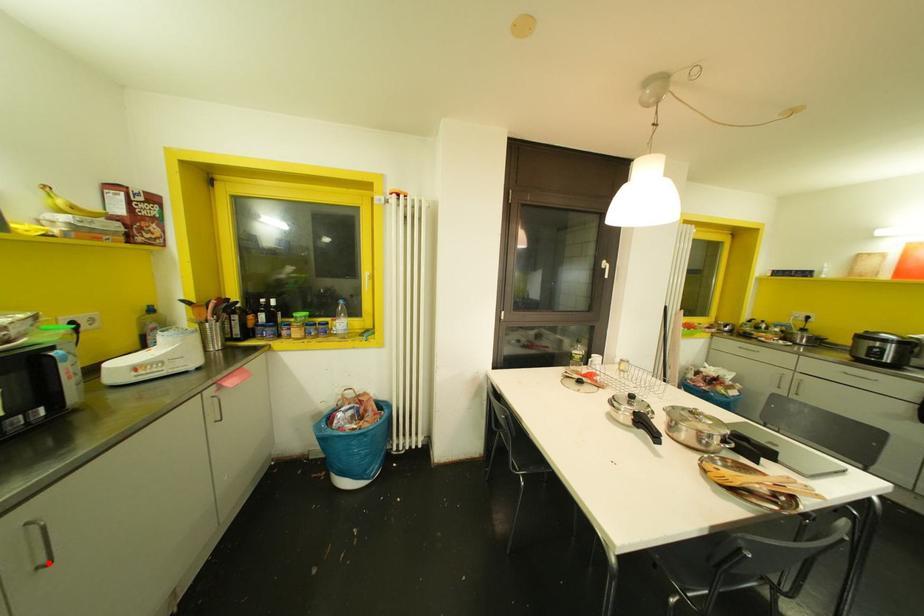
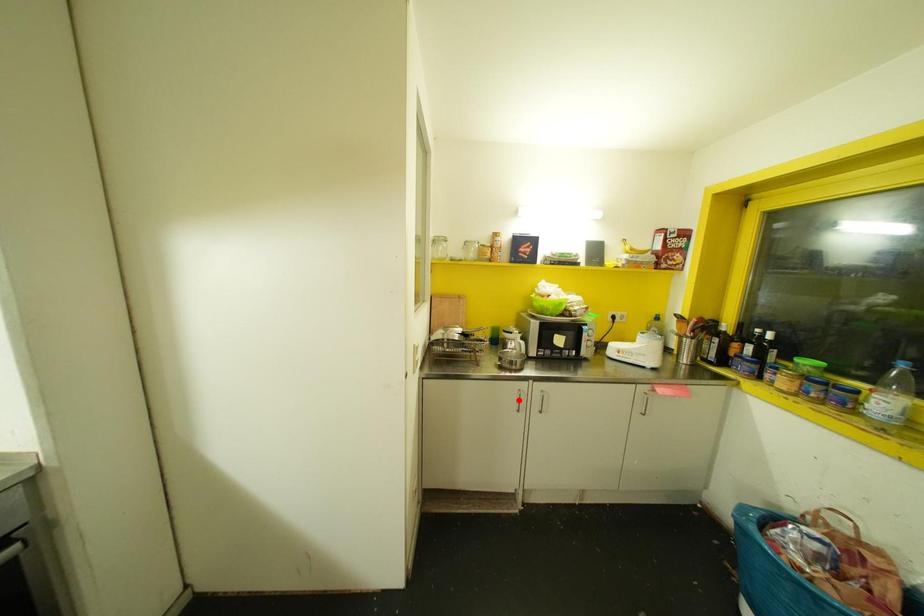
I am providing you with two images of the same scene from different viewpoints. A red point is marked on the first image and another point is marked on the second image. Do the highlighted points in image1 and image2 indicate the same real-world spot?

No